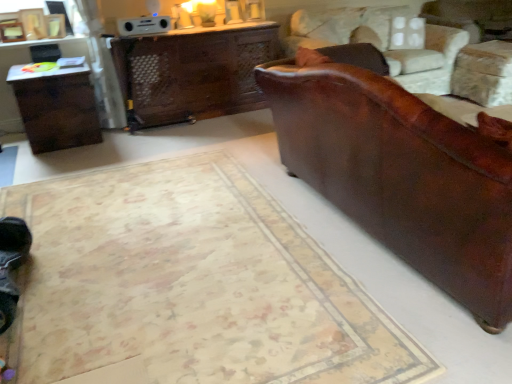
Question: Can you see dark brown wood table at left touching leather couch at right?

Choices:
 (A) yes
 (B) no

Answer: (B)

Question: Does dark brown wood table at left have a smaller size compared to leather couch at right?

Choices:
 (A) yes
 (B) no

Answer: (A)

Question: From a real-world perspective, does dark brown wood table at left sit lower than leather couch at right?

Choices:
 (A) yes
 (B) no

Answer: (A)

Question: Is leather couch at right at the back of dark brown wood table at left?

Choices:
 (A) yes
 (B) no

Answer: (B)

Question: From a real-world perspective, does dark brown wood table at left stand above leather couch at right?

Choices:
 (A) no
 (B) yes

Answer: (A)

Question: Visually, is brown leather swivel chair at right positioned to the left or to the right of dark brown wood table at left?

Choices:
 (A) right
 (B) left

Answer: (A)

Question: Is brown leather swivel chair at right bigger or smaller than dark brown wood table at left?

Choices:
 (A) small
 (B) big

Answer: (B)

Question: From a real-world perspective, is brown leather swivel chair at right positioned above or below dark brown wood table at left?

Choices:
 (A) below
 (B) above

Answer: (B)

Question: In terms of width, does brown leather swivel chair at right look wider or thinner when compared to dark brown wood table at left?

Choices:
 (A) wide
 (B) thin

Answer: (A)

Question: In the image, is beige carpet at lower right positioned in front of or behind brown leather swivel chair at right?

Choices:
 (A) front
 (B) behind

Answer: (A)

Question: In the image, is beige carpet at lower right on the left side or the right side of brown leather swivel chair at right?

Choices:
 (A) right
 (B) left

Answer: (B)

Question: Is beige carpet at lower right situated inside brown leather swivel chair at right or outside?

Choices:
 (A) outside
 (B) inside

Answer: (A)

Question: Looking at their shapes, would you say beige carpet at lower right is wider or thinner than brown leather swivel chair at right?

Choices:
 (A) thin
 (B) wide

Answer: (B)

Question: In the image, is dark brown wood table at left positioned in front of or behind brown leather swivel chair at right?

Choices:
 (A) behind
 (B) front

Answer: (B)

Question: From their relative heights in the image, would you say dark brown wood table at left is taller or shorter than brown leather swivel chair at right?

Choices:
 (A) tall
 (B) short

Answer: (B)